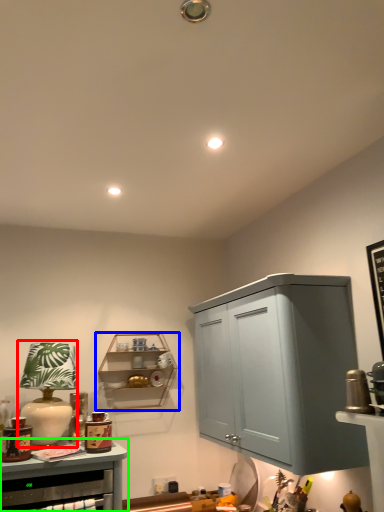
Question: Which is farther away from table lamp (highlighted by a red box)? shelf (highlighted by a blue box) or cabinetry (highlighted by a green box)?

Choices:
 (A) shelf
 (B) cabinetry

Answer: (A)